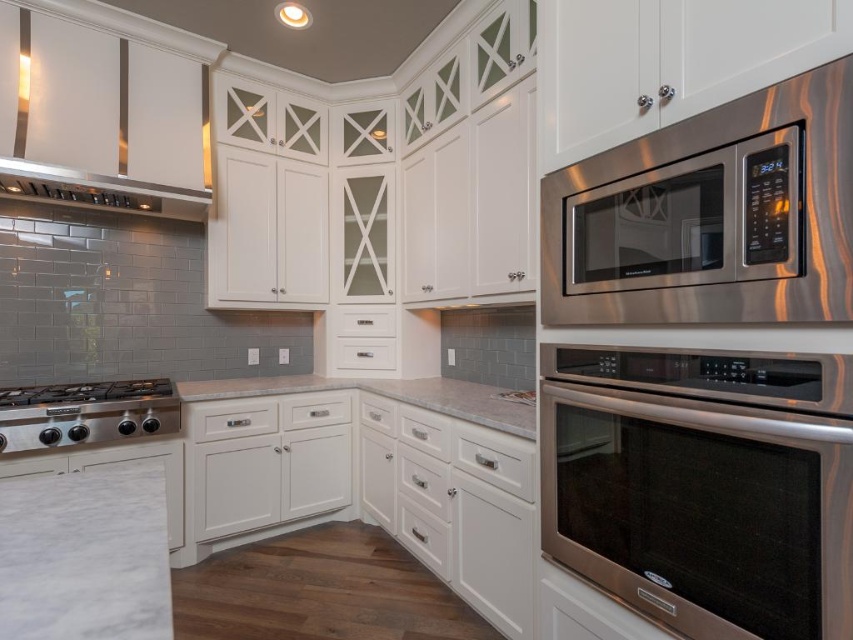
Question: Which of the following is the closest to the observer?

Choices:
 (A) granite/stone countertop at center
 (B) stainless steel gas stove at lower left

Answer: (A)

Question: Which point is farther to the camera?

Choices:
 (A) (111, 417)
 (B) (618, 358)
 (C) (618, 252)

Answer: (A)

Question: Is stainless steel microwave at upper right to the left of granite/stone countertop at center from the viewer's perspective?

Choices:
 (A) yes
 (B) no

Answer: (B)

Question: Which object is the closest to the stainless steel gas stove at lower left?

Choices:
 (A) granite/stone countertop at center
 (B) stainless steel microwave at upper right

Answer: (A)

Question: Does stainless steel gas stove at lower left come behind granite/stone countertop at center?

Choices:
 (A) yes
 (B) no

Answer: (A)

Question: Does stainless steel oven at upper right have a larger size compared to satin white exhaust hood at upper left?

Choices:
 (A) no
 (B) yes

Answer: (A)